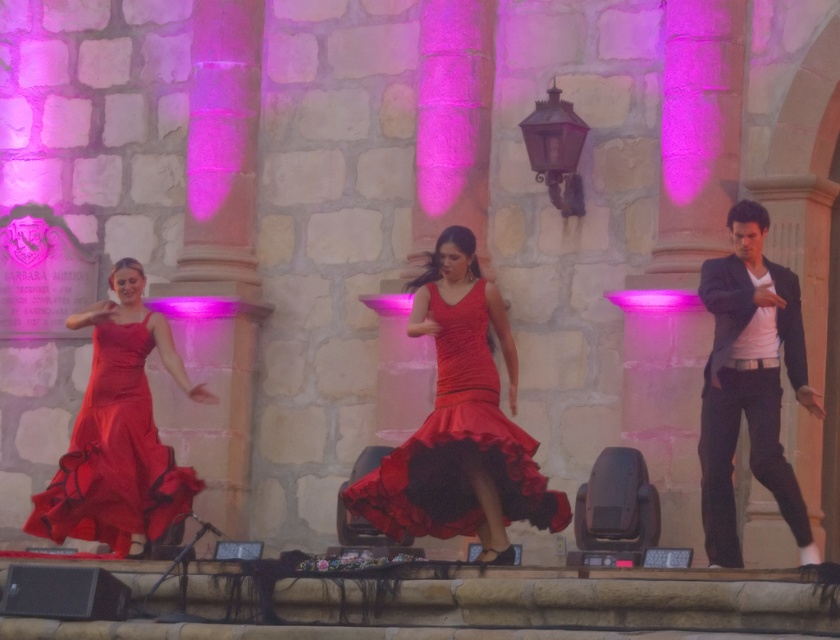
You are standing at the center of the stage and want to move to the dark gray suit at right. Which direction should you move in to reach it?

You should move to the right to reach the dark gray suit at right since it is located at the right side of the stage.

You are standing at the camera position and want to walk to the point marked as point (463, 445). Is this point within a 50 meter radius from your current position?

The distance between point (463, 445) and the camera is 38.62 meters, which is within the 50 meter radius, so yes, the point is within the 50 meter radius.

You are an event planner assessing the stage setup. You need to ensure that the dark gray suit at right and the satin dress at center are visible to the audience seated in the front row. Based on their heights, which performer might require a raised platform to ensure visibility?

The dark gray suit at right is taller than the satin dress at center. Since the dark gray suit at right is already taller, the satin dress at center might need a raised platform to be seen clearly by the front row audience.